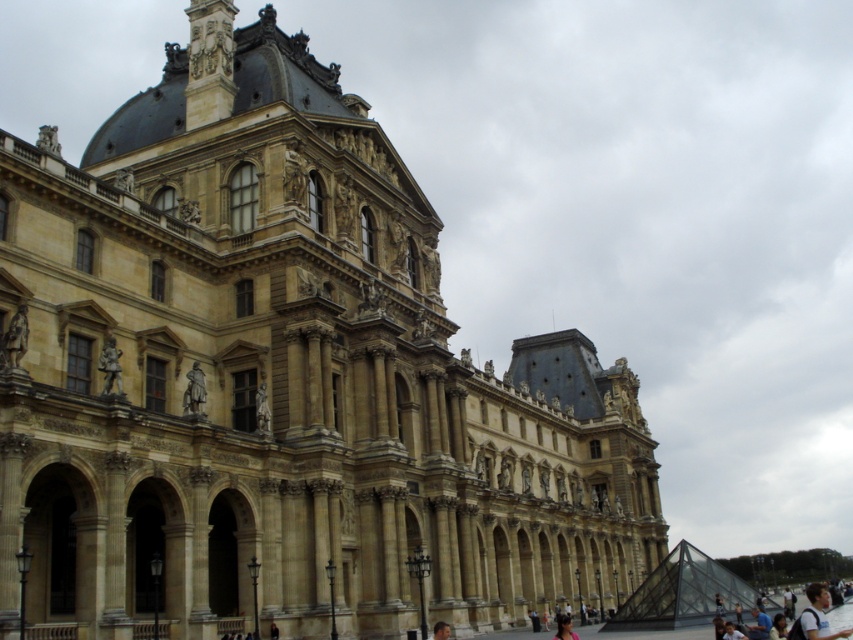
You are standing in front of the historic building and want to take a photo that includes both the light brown hair at lower right and the bronze statue at center. Which object should you position closer to the camera to ensure both are in focus?

You should position the light brown hair at lower right closer to the camera since it is already closer to the viewer than the bronze statue at center, allowing both to be in focus by adjusting the camera focus range appropriately.

Based on the photo, you are an art student visiting the Louvre Museum. You notice a blurred fabric person at lower center and a dark brown hair at lower center in your view. Which object is positioned higher in the scene?

The dark brown hair at lower center is positioned higher because the blurred fabric person at lower center is located below it.

You are standing in front of the historic building and see two people with light brown hair at lower right and dark brown hair at lower center. Which person is closer to you?

The light brown hair at lower right is in front of the dark brown hair at lower center, so the person with light brown hair at lower right is closer to you.